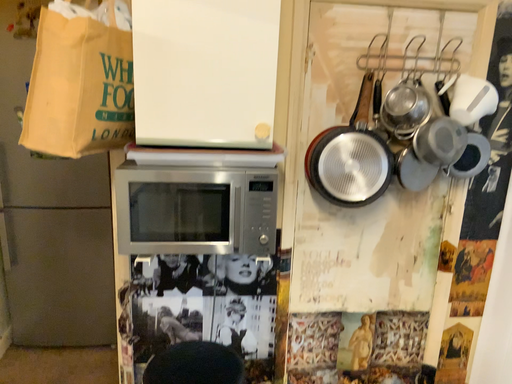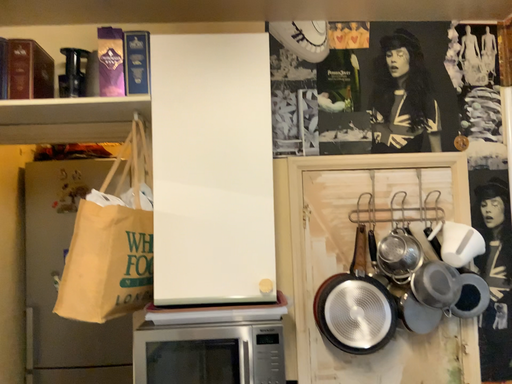
Question: How did the camera likely rotate when shooting the video?

Choices:
 (A) rotated upward
 (B) rotated downward

Answer: (A)